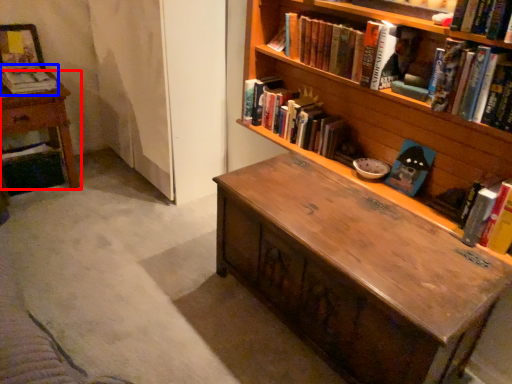
Question: Which point is closer to the camera, table (highlighted by a red box) or book (highlighted by a blue box)?

Choices:
 (A) table
 (B) book

Answer: (A)